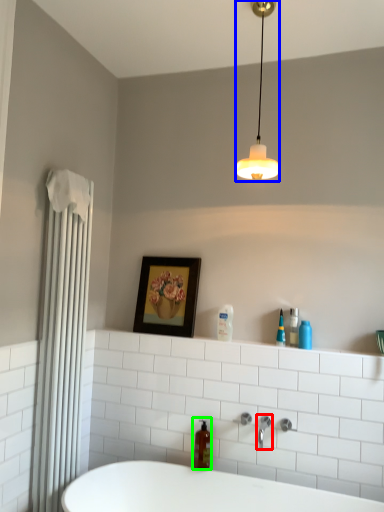
Question: Based on their relative distances, which object is nearer to tap (highlighted by a red box)? Choose from lamp (highlighted by a blue box) and soap dispenser (highlighted by a green box).

Choices:
 (A) lamp
 (B) soap dispenser

Answer: (B)